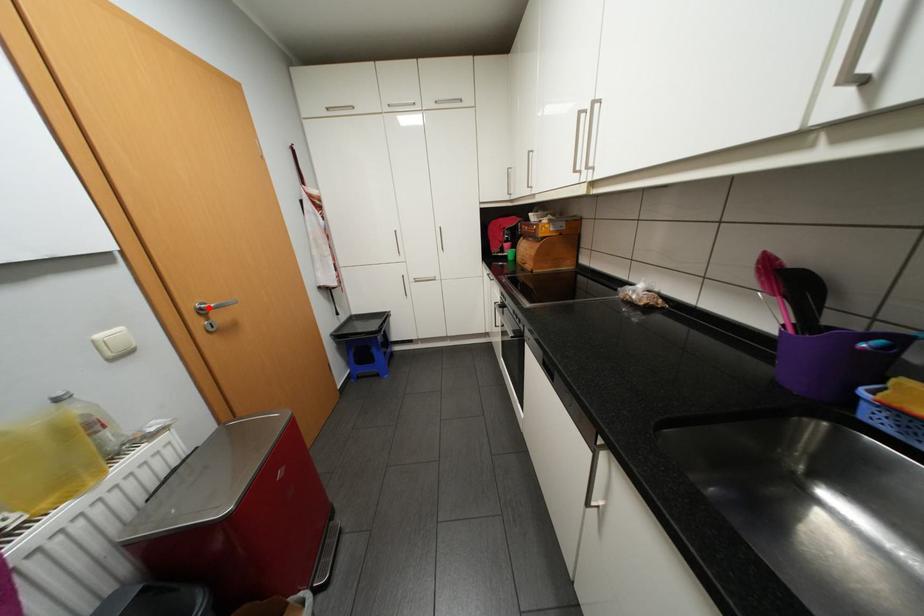
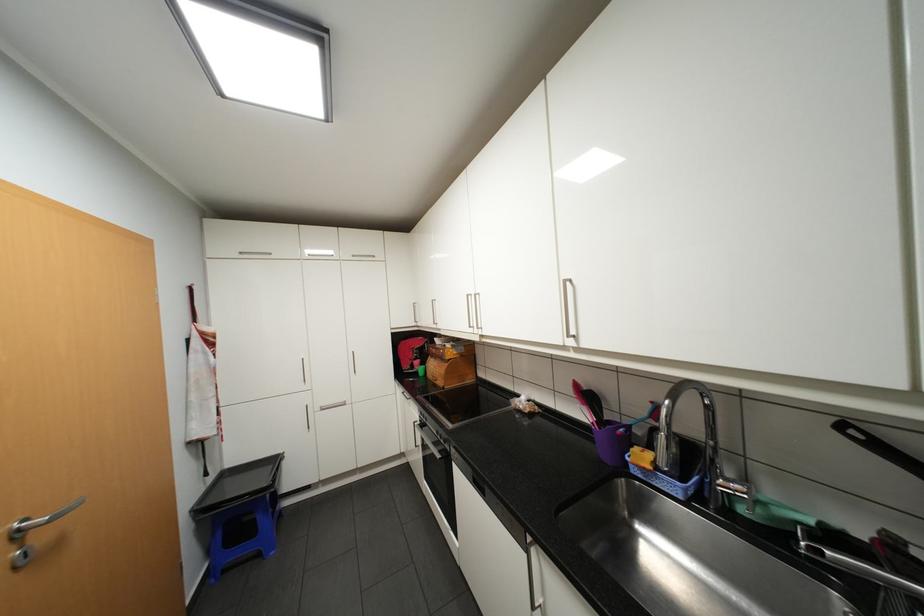
Where in the second image is the point corresponding to the highlighted location from the first image?

(27, 530)